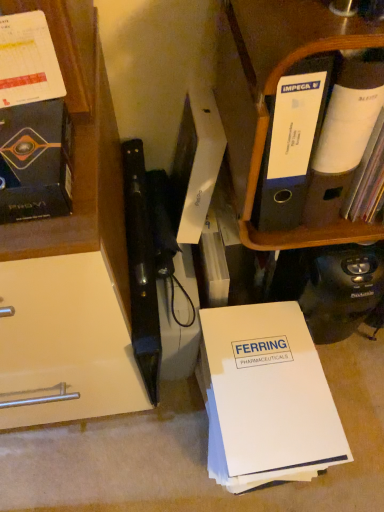
What do you see at coordinates (35, 161) in the screenshot?
I see `matte black book at left` at bounding box center [35, 161].

What is the approximate width of matte black book at left?

It is 5.98 inches.

Measure the distance between black plastic folder at upper right and camera.

The depth of black plastic folder at upper right is 43.87 centimeters.

This screenshot has width=384, height=512. I want to click on white paper at center, so click(266, 397).

Consider the image. Is white paper at center oriented towards matte black book at left?

No, white paper at center is not facing towards matte black book at left.

Is white paper at center taller than matte black book at left?

Yes, white paper at center is taller than matte black book at left.

Who is more distant, white paper at center or matte black book at left?

white paper at center.

Based on the photo, from the image's perspective, between white paper at center and matte black book at left, who is located below?

white paper at center is shown below in the image.

Can we say black plastic folder at upper right lies outside matte black book at left?

black plastic folder at upper right is positioned outside matte black book at left.

Is black plastic folder at upper right smaller than matte black book at left?

Incorrect, black plastic folder at upper right is not smaller in size than matte black book at left.

How many degrees apart are the facing directions of black plastic folder at upper right and matte black book at left?

They differ by 0.86 degrees in their facing directions.

Considering the sizes of black plastic folder at upper right and matte black book at left in the image, is black plastic folder at upper right wider or thinner than matte black book at left?

In the image, black plastic folder at upper right appears to be wider than matte black book at left.

Is matte black book at left oriented towards white paper at center?

No, matte black book at left is not facing towards white paper at center.

From the picture: Are matte black book at left and white paper at center beside each other?

→ No, matte black book at left is not touching white paper at center.

Considering the relative sizes of matte black book at left and white paper at center in the image provided, is matte black book at left taller than white paper at center?

In fact, matte black book at left may be shorter than white paper at center.

From the picture: From a real-world perspective, which object rests below the other?

white paper at center.

Is black plastic folder at upper right to the right of white paper at center from the viewer's perspective?

Yes.

Is black plastic folder at upper right positioned with its back to white paper at center?

No, black plastic folder at upper right is not facing away from white paper at center.

Is black plastic folder at upper right not close to white paper at center?

They are positioned close to each other.

Is point (361, 36) closer or farther from the camera than point (232, 381)?

Point (361, 36) is closer to the camera than point (232, 381).

Considering their positions, is white paper at center located in front of or behind black plastic folder at upper right?

Clearly, white paper at center is behind black plastic folder at upper right.

From their relative heights in the image, would you say white paper at center is taller or shorter than black plastic folder at upper right?

white paper at center is shorter than black plastic folder at upper right.

At what (x,y) coordinates should I click in order to perform the action: click on paperback book to the left of black plastic folder at upper right. Please return your answer as a coordinate pair (x, y). The height and width of the screenshot is (512, 384). Looking at the image, I should click on (266, 397).

Is white paper at center turned away from black plastic folder at upper right?

That's not correct — white paper at center is not looking away from black plastic folder at upper right.

Does point (9, 162) come in front of point (275, 30)?

Yes, point (9, 162) is in front of point (275, 30).

From a real-world perspective, which object rests below the other?

black plastic folder at upper right, from a real-world perspective.

Does matte black book at left have a greater height compared to black plastic folder at upper right?

No, matte black book at left is not taller than black plastic folder at upper right.

Is matte black book at left touching black plastic folder at upper right?

No, matte black book at left is not touching black plastic folder at upper right.

Locate an element on the screen. This screenshot has width=384, height=512. book above the white paper at center (from a real-world perspective) is located at coordinates (35, 161).

Locate an element on the screen. This screenshot has height=512, width=384. shelf behind the matte black book at left is located at coordinates (274, 95).

From the image, which object appears to be nearer to white paper at center, black plastic folder at upper right or matte black book at left?

Among the two, black plastic folder at upper right is located nearer to white paper at center.

When comparing their distances from matte black book at left, does white paper at center or black plastic folder at upper right seem closer?

Based on the image, black plastic folder at upper right appears to be nearer to matte black book at left.

Estimate the real-world distances between objects in this image. Which object is closer to white paper at center, matte black book at left or black plastic folder at upper right?

Among the two, black plastic folder at upper right is located nearer to white paper at center.

Looking at the image, which one is located further to black plastic folder at upper right, white paper at center or matte black book at left?

Among the two, white paper at center is located further to black plastic folder at upper right.

Estimate the real-world distances between objects in this image. Which object is further from matte black book at left, black plastic folder at upper right or white paper at center?

white paper at center is positioned further to the anchor matte black book at left.

Looking at the image, which one is located closer to black plastic folder at upper right, matte black book at left or white paper at center?

matte black book at left.

Image resolution: width=384 pixels, height=512 pixels. In order to click on book between black plastic folder at upper right and white paper at center from top to bottom in this screenshot , I will do `click(35, 161)`.